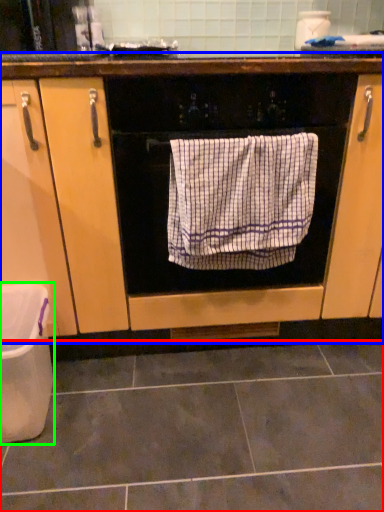
Question: Considering the real-world distances, which object is farthest from ceramic tile (highlighted by a red box)? cabinetry (highlighted by a blue box) or dish washer (highlighted by a green box)?

Choices:
 (A) cabinetry
 (B) dish washer

Answer: (A)